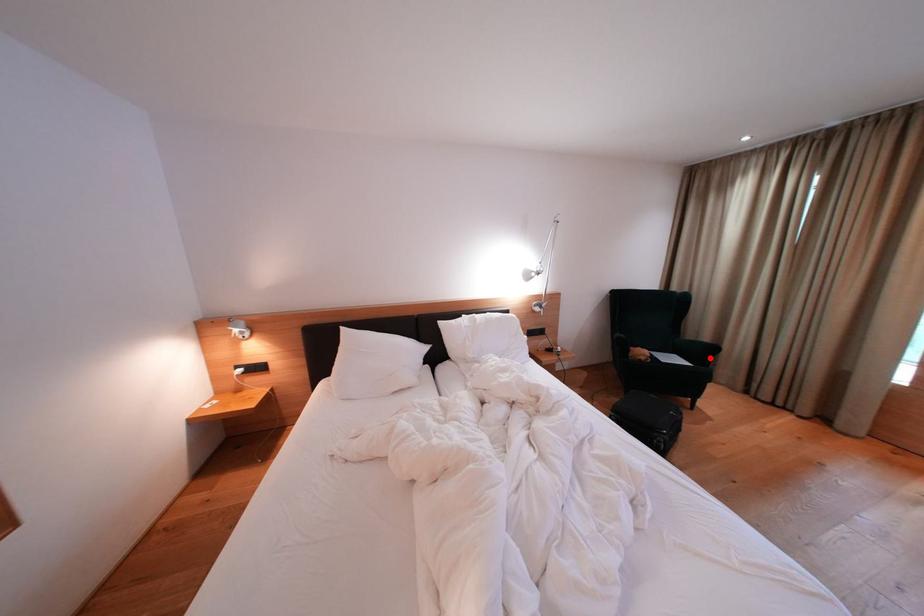
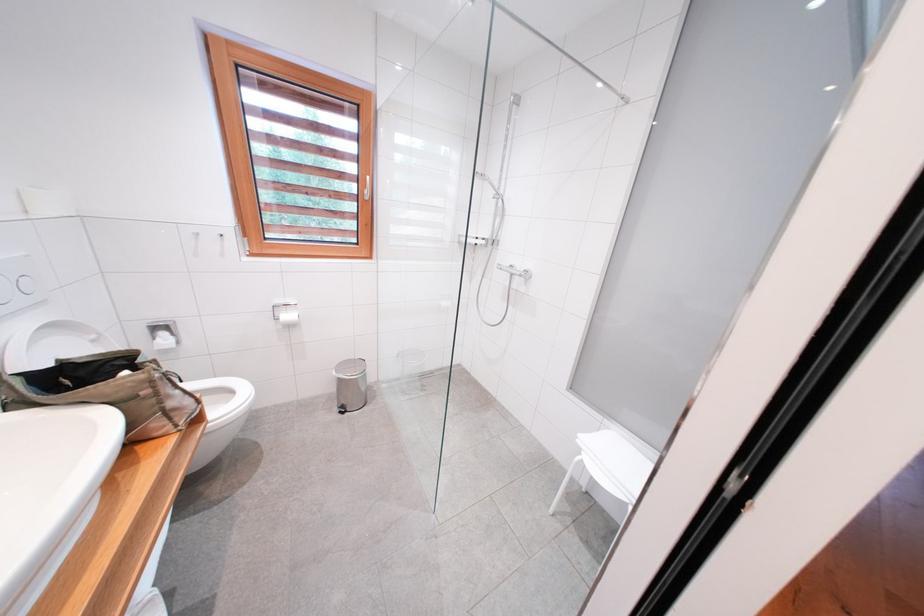
Question: I am providing you with two images of the same scene from different viewpoints. A red point is marked on the first image. At the location where the point appears in image 1, is it still visible in image 2?

Choices:
 (A) Yes
 (B) No

Answer: (B)